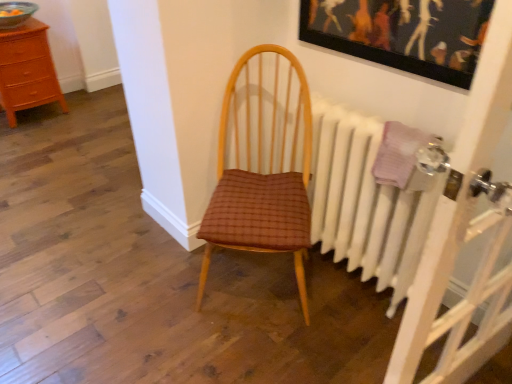
Question: Is wooden chest of drawers at left positioned behind white painted radiator at right?

Choices:
 (A) no
 (B) yes

Answer: (B)

Question: Is wooden chest of drawers at left facing away from white painted radiator at right?

Choices:
 (A) yes
 (B) no

Answer: (B)

Question: Is wooden chest of drawers at left smaller than white painted radiator at right?

Choices:
 (A) no
 (B) yes

Answer: (A)

Question: Is wooden chest of drawers at left aimed at white painted radiator at right?

Choices:
 (A) yes
 (B) no

Answer: (A)

Question: Would you consider wooden chest of drawers at left to be distant from white painted radiator at right?

Choices:
 (A) no
 (B) yes

Answer: (B)

Question: Is wooden chest of drawers at left in front of white painted radiator at right?

Choices:
 (A) no
 (B) yes

Answer: (A)

Question: Is wooden picture frame at upper center to the left of white painted radiator at right from the viewer's perspective?

Choices:
 (A) yes
 (B) no

Answer: (B)

Question: Does wooden picture frame at upper center have a smaller size compared to white painted radiator at right?

Choices:
 (A) yes
 (B) no

Answer: (A)

Question: Does wooden picture frame at upper center contain white painted radiator at right?

Choices:
 (A) no
 (B) yes

Answer: (A)

Question: Can you confirm if wooden picture frame at upper center is thinner than white painted radiator at right?

Choices:
 (A) no
 (B) yes

Answer: (B)

Question: Can you confirm if wooden picture frame at upper center is wider than white painted radiator at right?

Choices:
 (A) no
 (B) yes

Answer: (A)

Question: Considering the relative sizes of wooden picture frame at upper center and white painted radiator at right in the image provided, is wooden picture frame at upper center bigger than white painted radiator at right?

Choices:
 (A) no
 (B) yes

Answer: (A)

Question: Considering the relative positions of brown woven fabric chair at center and white painted radiator at right in the image provided, is brown woven fabric chair at center to the right of white painted radiator at right from the viewer's perspective?

Choices:
 (A) yes
 (B) no

Answer: (B)